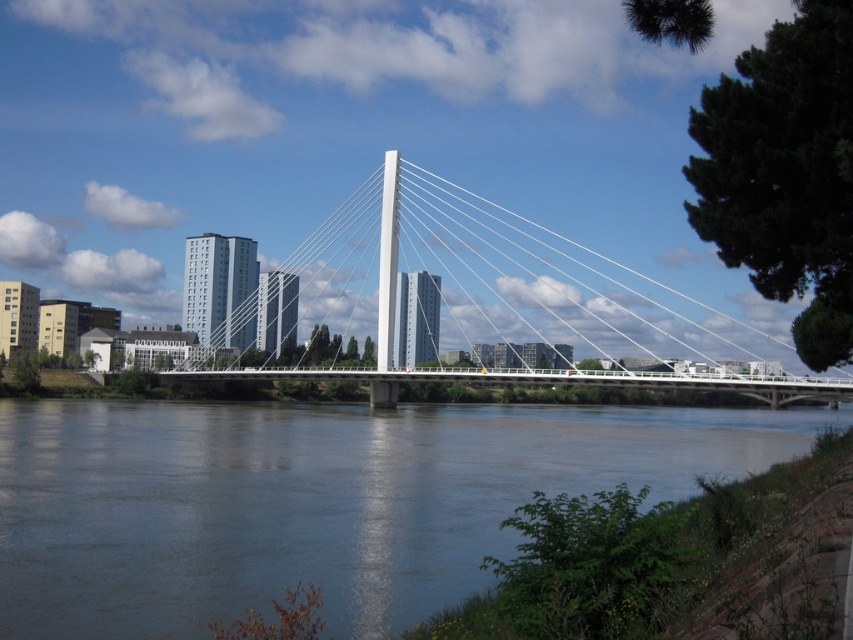
Between dark blue water at lower center and white metallic suspension bridge at center, which one is positioned lower?

dark blue water at lower center is below.

Is dark blue water at lower center further to camera compared to white metallic suspension bridge at center?

No.

Where is `dark blue water at lower center`? This screenshot has height=640, width=853. dark blue water at lower center is located at coordinates (315, 500).